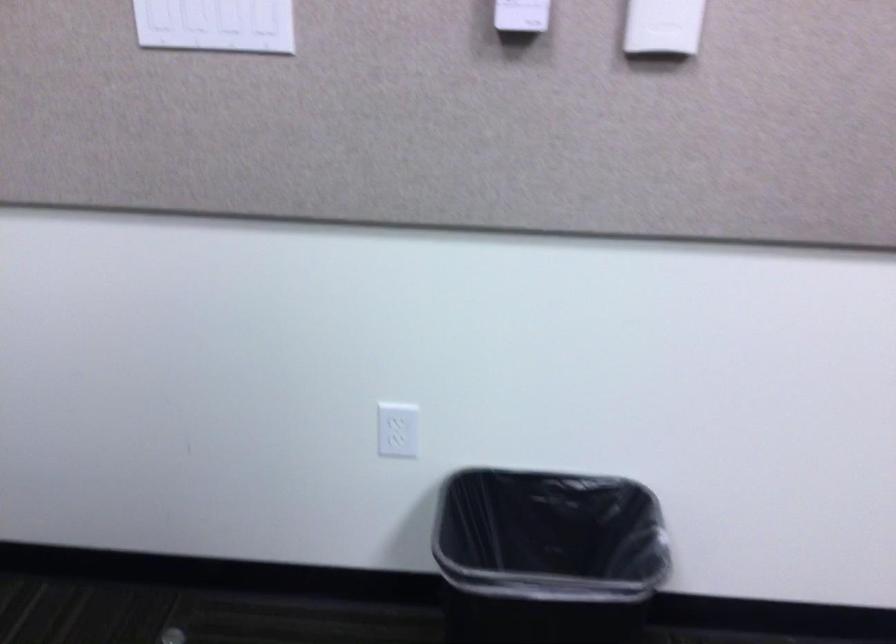
Where would you lift the black trash can? Please return your answer as a coordinate pair (x, y).

(547, 556)